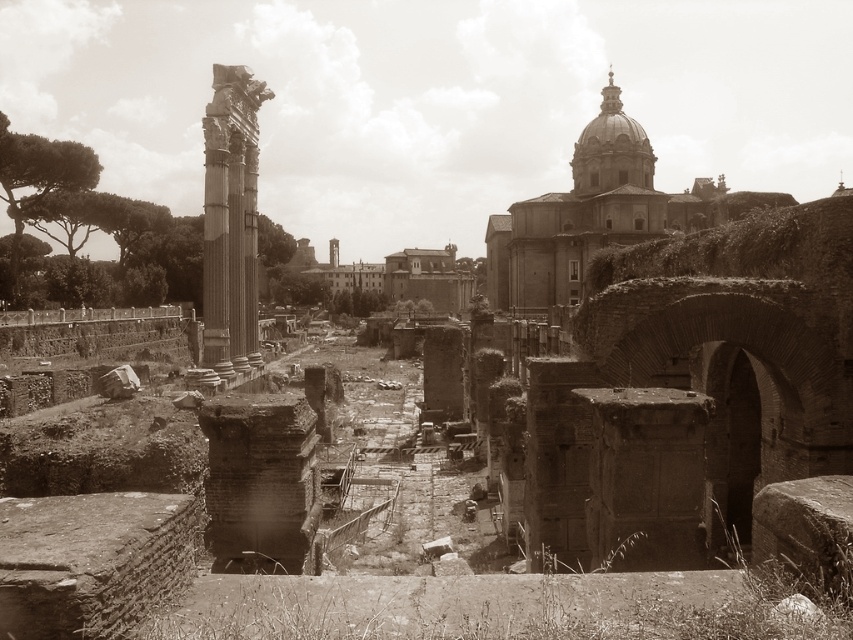
Question: Is smooth stone dome at upper right smaller than smooth stone column at left?

Choices:
 (A) yes
 (B) no

Answer: (B)

Question: Which point is closer to the camera?

Choices:
 (A) smooth stone dome at upper right
 (B) smooth stone column at left

Answer: (B)

Question: Is smooth stone dome at upper right smaller than smooth stone column at left?

Choices:
 (A) no
 (B) yes

Answer: (A)

Question: Which point is closer to the camera taking this photo?

Choices:
 (A) (540, 202)
 (B) (204, 216)

Answer: (B)

Question: Can you confirm if smooth stone dome at upper right is positioned to the left of smooth stone column at left?

Choices:
 (A) yes
 (B) no

Answer: (B)